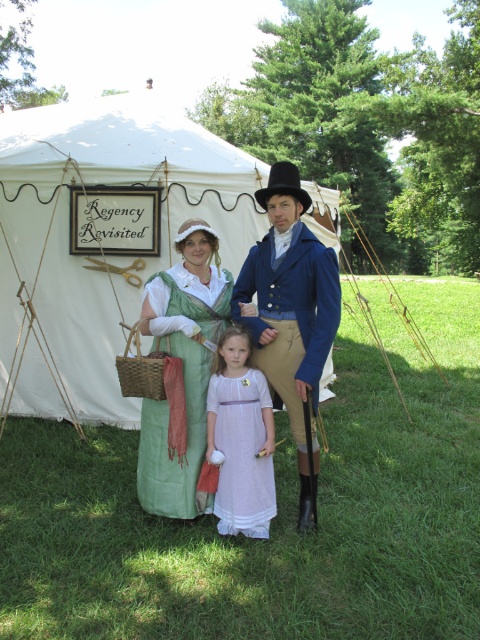
You are organizing a costume display and need to arrange the light purple cotton dress at center and the green satin dress at center on a mannequin stand. Which dress should you place on the smaller mannequin?

The light purple cotton dress at center is smaller than the green satin dress at center, so it should be placed on the smaller mannequin.

You are organizing a historical reenactment event and need to ensure that all participants have enough space to move around. You notice the blue wool coat at center and the light purple cotton dress at center are both worn by participants standing near each other. Which garment would require more horizontal space due to its size?

The blue wool coat at center requires more horizontal space because its width is larger than the light purple cotton dress at center.